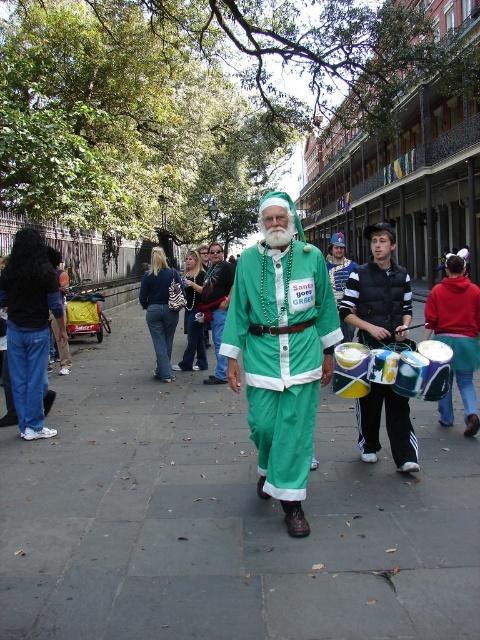
Question: Which object appears closest to the camera in this image?

Choices:
 (A) black and white striped vest at center
 (B) green satin santa at center
 (C) green matte santa suit at center
 (D) green fabric pants at center

Answer: (B)

Question: Does green fabric pants at center have a larger size compared to green matte santa suit at center?

Choices:
 (A) yes
 (B) no

Answer: (B)

Question: Which point appears farthest from the camera in this image?

Choices:
 (A) (253, 499)
 (B) (216, 365)

Answer: (B)

Question: Is black and white striped vest at center further to camera compared to green matte santa suit at center?

Choices:
 (A) no
 (B) yes

Answer: (A)

Question: Does green fabric pants at center lie behind green matte santa suit at center?

Choices:
 (A) yes
 (B) no

Answer: (B)

Question: Which of these objects is positioned closest to the black and white striped vest at center?

Choices:
 (A) green satin santa at center
 (B) green fabric pants at center
 (C) green matte santa suit at center

Answer: (A)